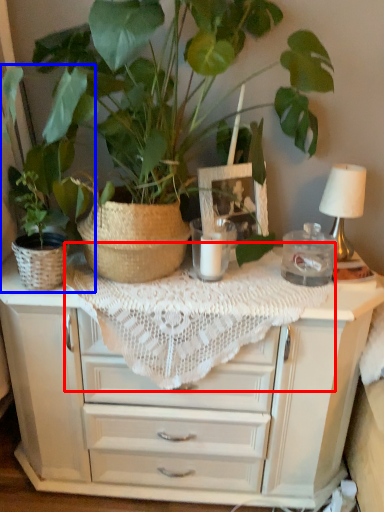
Question: Which object appears closest to the camera in this image, tablecloth (highlighted by a red box) or houseplant (highlighted by a blue box)?

Choices:
 (A) tablecloth
 (B) houseplant

Answer: (A)